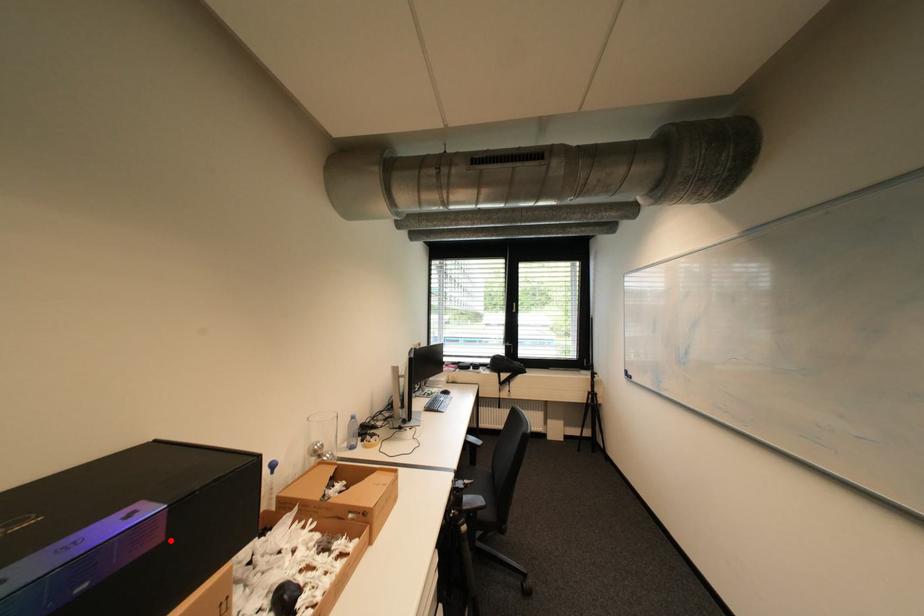
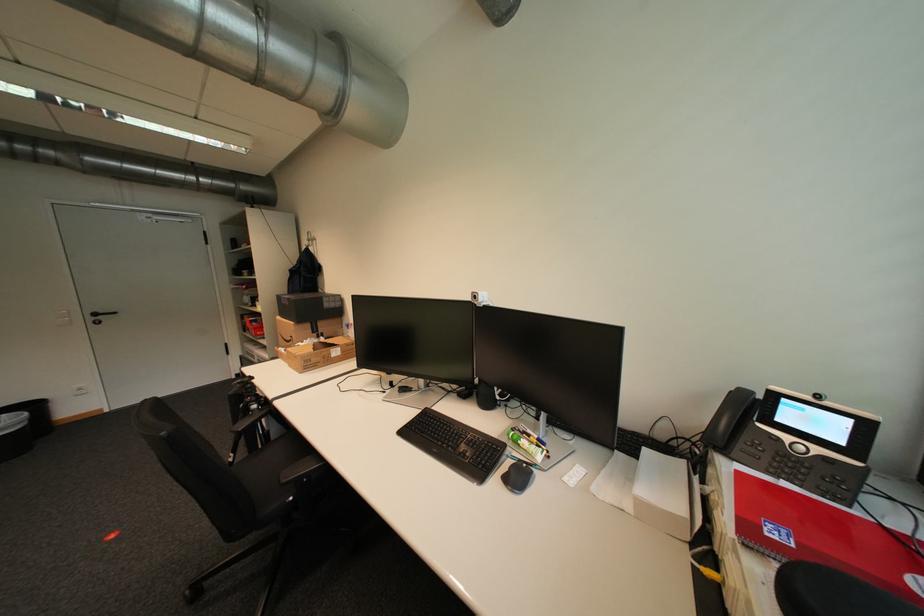
Find the pixel in the second image that matches the highlighted location in the first image.

(296, 305)